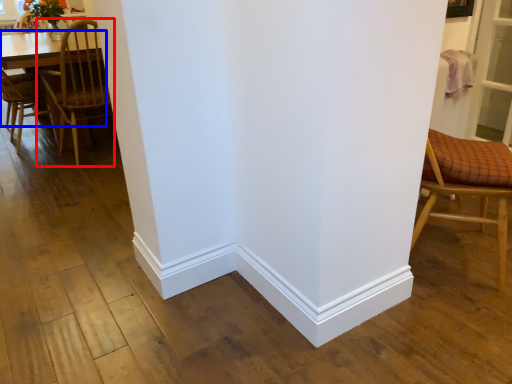
Question: Which object is further to the camera taking this photo, chair (highlighted by a red box) or table (highlighted by a blue box)?

Choices:
 (A) chair
 (B) table

Answer: (B)